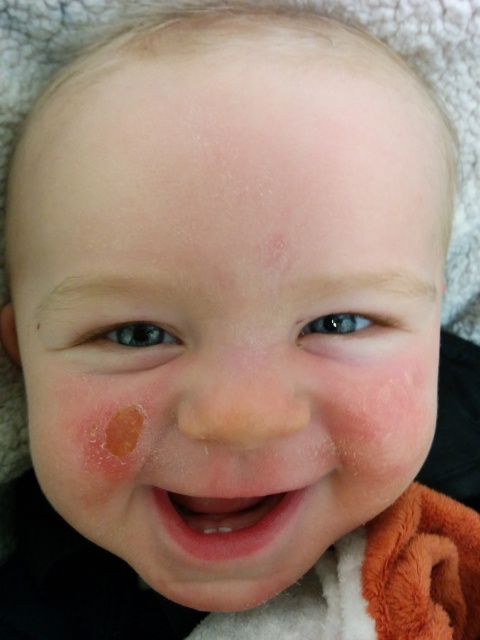
You are a photographer adjusting the focus on a camera lens. You need to ensure that both points, point 1 at point (289, 392) and point 2 at point (168, 506), are in focus. Given that the depth of field can only accommodate one plane of focus, which point should you focus on to capture the closest object?

You should focus on point (289, 392) because it is closer to the camera than point (168, 506), so focusing on the closer point will ensure it is in focus while the farther point may be slightly out of focus depending on the depth of field.